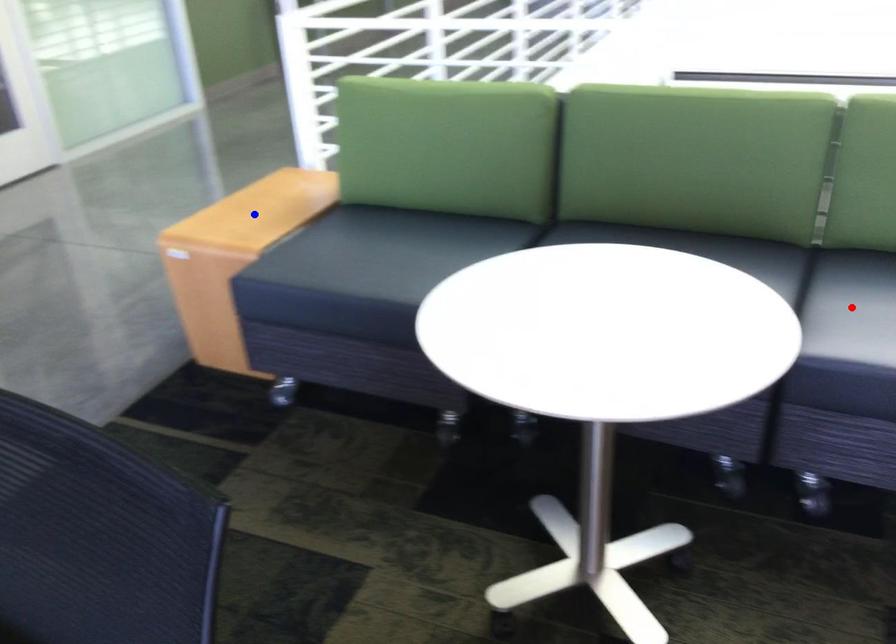
Question: Which of the two points in the image is closer to the camera?

Choices:
 (A) Blue point is closer.
 (B) Red point is closer.

Answer: (B)